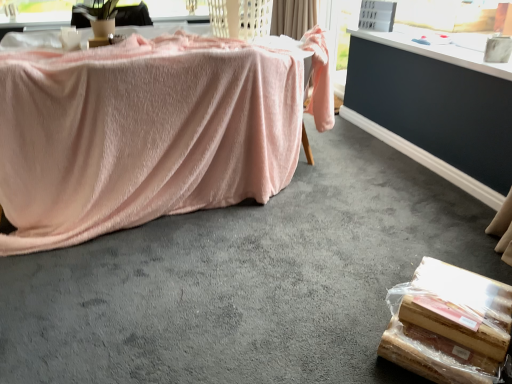
Question: Would you say pink fabric-covered object at left is to the left or to the right of wooden board at lower right in the picture?

Choices:
 (A) left
 (B) right

Answer: (A)

Question: Based on their sizes in the image, would you say pink fabric-covered object at left is bigger or smaller than wooden board at lower right?

Choices:
 (A) big
 (B) small

Answer: (A)

Question: Based on their relative distances, which object is farther from the dark gray carpet at lower right?

Choices:
 (A) pink fabric-covered object at left
 (B) wooden board at lower right
 (C) beige fabric curtain at upper center

Answer: (B)

Question: Which object is positioned farthest from the pink fabric-covered object at left?

Choices:
 (A) beige fabric curtain at upper center
 (B) wooden board at lower right
 (C) dark gray carpet at lower right

Answer: (A)